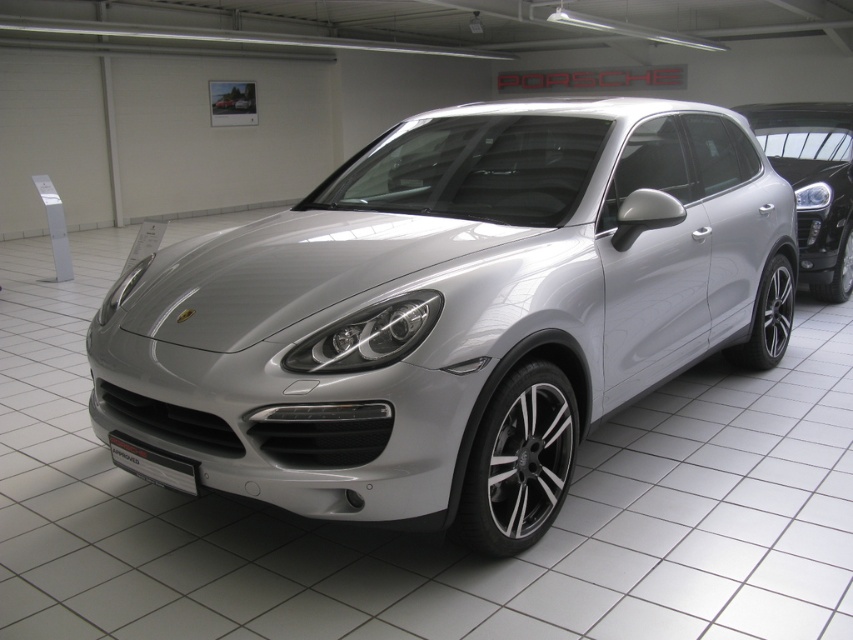
Question: Which point is farther from the camera taking this photo?

Choices:
 (A) (514, 269)
 (B) (776, 122)

Answer: (B)

Question: Is silver metallic suv at center above satin silver suv at center?

Choices:
 (A) no
 (B) yes

Answer: (A)

Question: Is the position of silver metallic suv at center more distant than that of satin silver suv at center?

Choices:
 (A) no
 (B) yes

Answer: (A)

Question: Which point appears farthest from the camera in this image?

Choices:
 (A) (799, 259)
 (B) (535, 320)

Answer: (A)

Question: Which point is farther from the camera taking this photo?

Choices:
 (A) (762, 304)
 (B) (825, 218)

Answer: (B)

Question: Is silver metallic suv at center wider than satin silver suv at center?

Choices:
 (A) no
 (B) yes

Answer: (B)